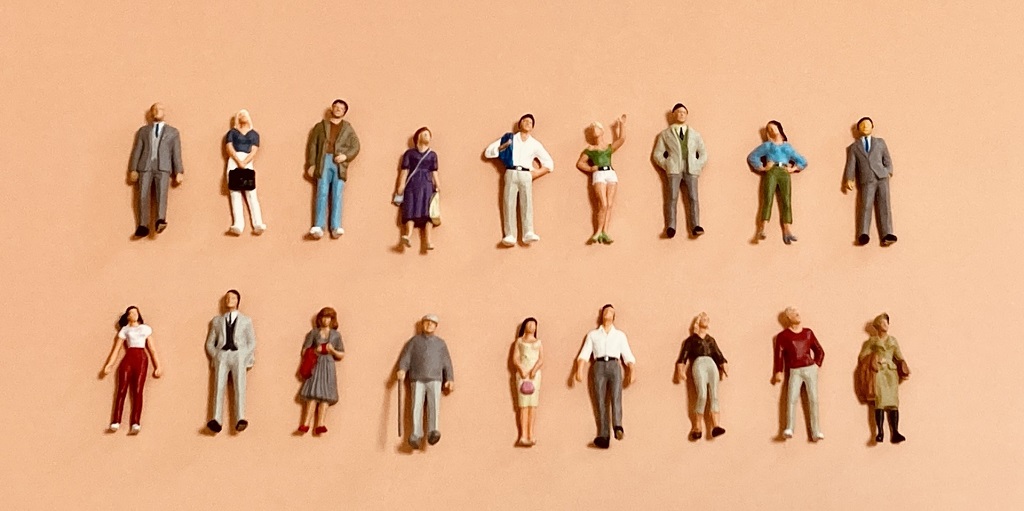
Where is `women figurines heads`? women figurines heads is located at coordinates (238, 117), (427, 131), (603, 131), (780, 130), (882, 322), (700, 325), (529, 326), (328, 319), (136, 313).